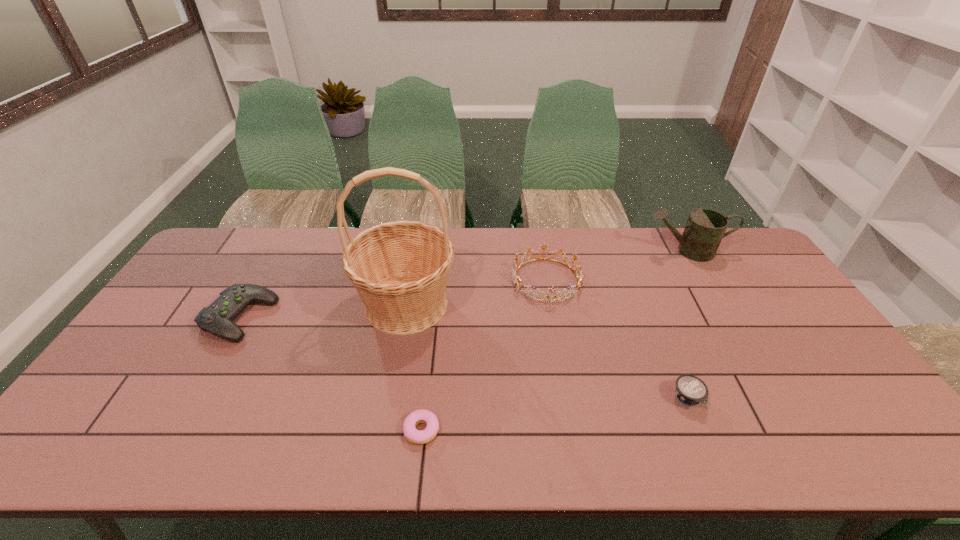
Locate an element on the screen. This screenshot has width=960, height=540. object positioned at the near edge is located at coordinates (415, 436).

You are a GUI agent. You are given a task and a screenshot of the screen. Output one action in this format:
    pyautogui.click(x=<x>, y=<y>)
    Task: Click on the object at the left edge
    The height and width of the screenshot is (540, 960).
    Given the screenshot: What is the action you would take?
    pyautogui.click(x=217, y=318)

I want to click on object positioned at the right edge, so click(x=705, y=228).

This screenshot has width=960, height=540. Find the location of `object that is at the far right corner`. object that is at the far right corner is located at coordinates (705, 228).

Find the location of a particular element. free region at the far edge is located at coordinates (586, 228).

This screenshot has height=540, width=960. Find the location of `vacant area at the near edge`. vacant area at the near edge is located at coordinates (467, 428).

The image size is (960, 540). In order to click on vacant space at the right edge of the desktop in this screenshot , I will do `click(735, 275)`.

The width and height of the screenshot is (960, 540). Find the location of `vacant region at the far right corner`. vacant region at the far right corner is located at coordinates (748, 267).

In the image, there is a desktop. Identify the location of free space at the near right corner. (849, 457).

This screenshot has width=960, height=540. I want to click on free spot between the second tallest object and the control, so click(464, 284).